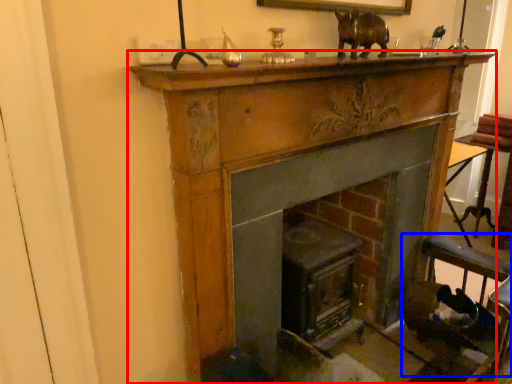
Question: Which point is further to the camera, fireplace (highlighted by a red box) or rocking chair (highlighted by a blue box)?

Choices:
 (A) fireplace
 (B) rocking chair

Answer: (B)